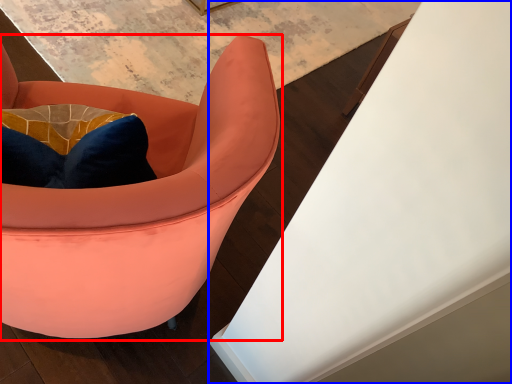
Question: Which object is closer to the camera taking this photo, chair (highlighted by a red box) or table (highlighted by a blue box)?

Choices:
 (A) chair
 (B) table

Answer: (A)